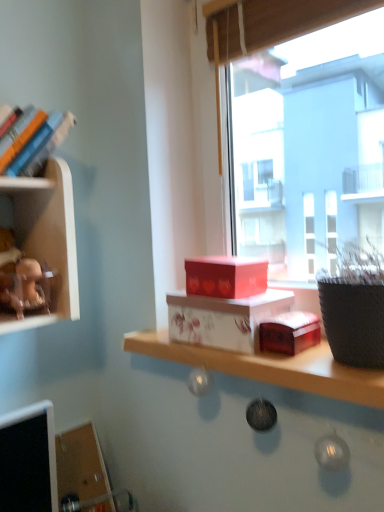
You are a GUI agent. You are given a task and a screenshot of the screen. Output one action in this format:
    pyautogui.click(x=<x>, y=<y>)
    Task: Click on the white glossy box at center
    The image size is (384, 512).
    Given the screenshot: What is the action you would take?
    pos(271,367)

At what (x,y) coordinates should I click in order to perform the action: click on hardcover books at left. Please return your answer as a coordinate pair (x, y). The width and height of the screenshot is (384, 512). Looking at the image, I should click on (42, 145).

Find the location of a particular element. The height and width of the screenshot is (512, 384). transparent glass window at center is located at coordinates (305, 129).

From their relative heights in the image, would you say hardcover books at left is taller or shorter than white glossy box at center?

Considering their sizes, hardcover books at left has more height than white glossy box at center.

Is hardcover books at left oriented towards white glossy box at center?

No.

Is hardcover books at left next to white glossy box at center?

No, hardcover books at left is not in contact with white glossy box at center.

Considering the relative positions of hardcover books at left and white glossy box at center in the image provided, is hardcover books at left to the left or to the right of white glossy box at center?

hardcover books at left is positioned on white glossy box at center's left side.

Locate an element on the screen. shelf that appears in front of the transparent glass window at center is located at coordinates (271, 367).

Can you see transparent glass window at center touching white glossy box at center?

transparent glass window at center and white glossy box at center are clearly separated.

Is transparent glass window at center bigger than white glossy box at center?

Yes.

Is matte brown figurine at upper left positioned in front of white glossy box at center?

No, it is not.

In the scene shown: Is matte brown figurine at upper left bigger than white glossy box at center?

Incorrect, matte brown figurine at upper left is not larger than white glossy box at center.

How much distance is there between matte brown figurine at upper left and white glossy box at center?

matte brown figurine at upper left and white glossy box at center are 16.03 inches apart from each other.

Can you confirm if matte brown figurine at upper left is positioned to the left of white glossy box at center?

Yes, matte brown figurine at upper left is to the left of white glossy box at center.

In the scene shown: Which point is more distant from viewer, (233, 362) or (38, 308)?

The point (38, 308) is farther from the camera.

Visually, is white glossy box at center positioned to the left or to the right of matte brown figurine at upper left?

Based on their positions, white glossy box at center is located to the right of matte brown figurine at upper left.

How distant is white glossy box at center from matte brown figurine at upper left?

white glossy box at center and matte brown figurine at upper left are 16.03 inches apart.

From a real-world perspective, is white glossy box at center physically located above or below matte brown figurine at upper left?

Clearly, from a real-world perspective, white glossy box at center is below matte brown figurine at upper left.

This screenshot has width=384, height=512. Find the location of `book that appears behind the matte brown figurine at upper left`. book that appears behind the matte brown figurine at upper left is located at coordinates (42, 145).

Looking at this image, what's the angular difference between matte brown figurine at upper left and hardcover books at left's facing directions?

0.000997 degrees separate the facing orientations of matte brown figurine at upper left and hardcover books at left.

Based on the photo, which object is positioned more to the right, matte brown figurine at upper left or hardcover books at left?

Positioned to the right is matte brown figurine at upper left.

Which of these two, matte brown figurine at upper left or hardcover books at left, is bigger?

hardcover books at left is bigger.

Does point (233, 366) come in front of point (383, 145)?

Yes, point (233, 366) is closer to viewer.

Is white glossy box at center positioned in front of transparent glass window at center?

Yes.

From the picture: Considering the relative sizes of white glossy box at center and transparent glass window at center in the image provided, is white glossy box at center wider than transparent glass window at center?

Indeed, white glossy box at center has a greater width compared to transparent glass window at center.

From a real-world perspective, is white glossy box at center physically located above or below transparent glass window at center?

Clearly, from a real-world perspective, white glossy box at center is below transparent glass window at center.

Consider the image. Considering the sizes of objects matte brown figurine at upper left and transparent glass window at center in the image provided, who is thinner, matte brown figurine at upper left or transparent glass window at center?

Thinner between the two is matte brown figurine at upper left.

Considering the relative sizes of matte brown figurine at upper left and transparent glass window at center in the image provided, is matte brown figurine at upper left bigger than transparent glass window at center?

No, matte brown figurine at upper left is not bigger than transparent glass window at center.

Is matte brown figurine at upper left spatially inside transparent glass window at center, or outside of it?

matte brown figurine at upper left exists outside the volume of transparent glass window at center.

Find the location of a particular element. shelf on the right of hardcover books at left is located at coordinates (271, 367).

Where is `shelf on the left of transparent glass window at center`? The height and width of the screenshot is (512, 384). shelf on the left of transparent glass window at center is located at coordinates (271, 367).

From the image, which object appears to be nearer to hardcover books at left, matte brown figurine at upper left or transparent glass window at center?

Among the two, matte brown figurine at upper left is located nearer to hardcover books at left.

From the image, which object appears to be farther from hardcover books at left, white glossy box at center or transparent glass window at center?

transparent glass window at center is positioned further to the anchor hardcover books at left.

Considering their positions, is transparent glass window at center positioned further to hardcover books at left than matte brown figurine at upper left?

transparent glass window at center lies further to hardcover books at left than the other object.

Considering their positions, is hardcover books at left positioned further to matte brown figurine at upper left than white glossy box at center?

white glossy box at center is positioned further to the anchor matte brown figurine at upper left.

Considering their positions, is hardcover books at left positioned further to transparent glass window at center than matte brown figurine at upper left?

matte brown figurine at upper left.

When comparing their distances from matte brown figurine at upper left, does white glossy box at center or transparent glass window at center seem closer?

The object closer to matte brown figurine at upper left is white glossy box at center.

Which object lies nearer to the anchor point transparent glass window at center, white glossy box at center or hardcover books at left?

Based on the image, white glossy box at center appears to be nearer to transparent glass window at center.

Considering their positions, is matte brown figurine at upper left positioned further to transparent glass window at center than white glossy box at center?

Among the two, matte brown figurine at upper left is located further to transparent glass window at center.

Where is `toy between hardcover books at left and transparent glass window at center in the horizontal direction`? This screenshot has height=512, width=384. toy between hardcover books at left and transparent glass window at center in the horizontal direction is located at coordinates (24, 281).

Image resolution: width=384 pixels, height=512 pixels. Identify the location of shelf between hardcover books at left and transparent glass window at center in the horizontal direction. (271, 367).

You are a GUI agent. You are given a task and a screenshot of the screen. Output one action in this format:
    pyautogui.click(x=<x>, y=<y>)
    Task: Click on the toy between hardcover books at left and white glossy box at center from left to right
    This screenshot has height=512, width=384.
    Given the screenshot: What is the action you would take?
    pyautogui.click(x=24, y=281)

Where is `shelf between matte brown figurine at upper left and transparent glass window at center`? Image resolution: width=384 pixels, height=512 pixels. shelf between matte brown figurine at upper left and transparent glass window at center is located at coordinates (271, 367).